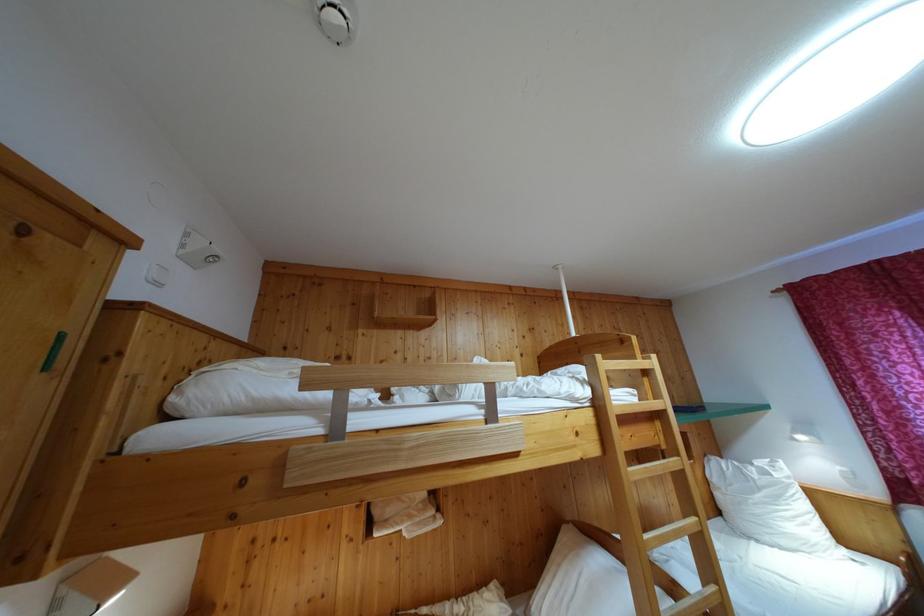
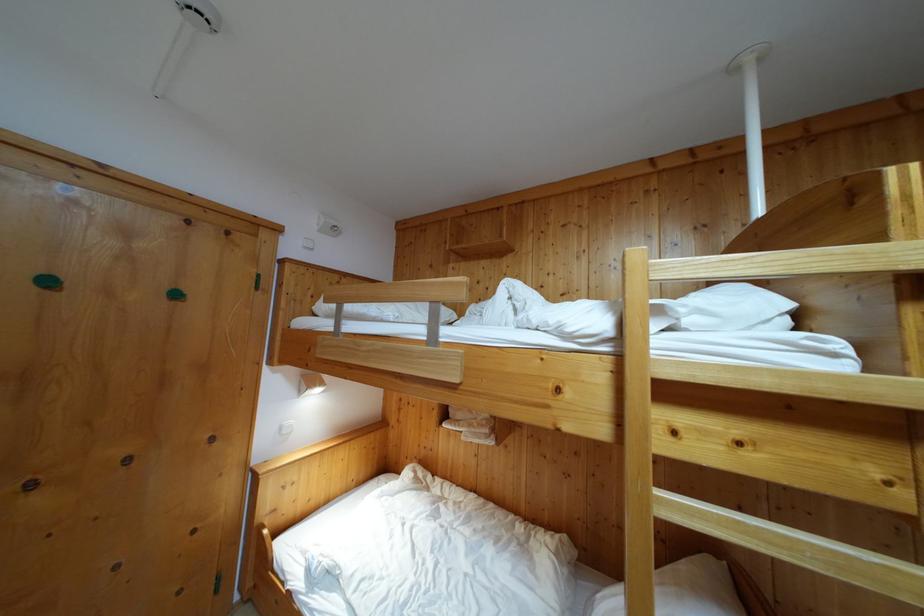
In the second image, find the point that corresponds to point (638, 363) in the first image.

(881, 245)